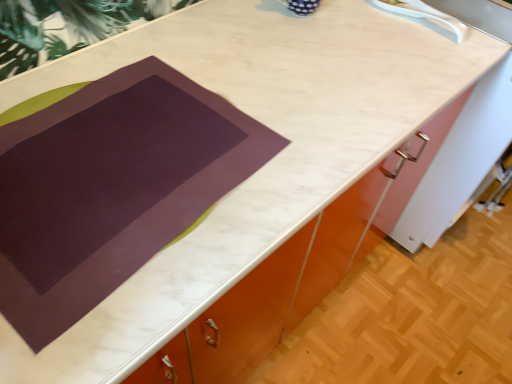
Where is `vacant space to the right of purple matte placemat at center`? vacant space to the right of purple matte placemat at center is located at coordinates (311, 145).